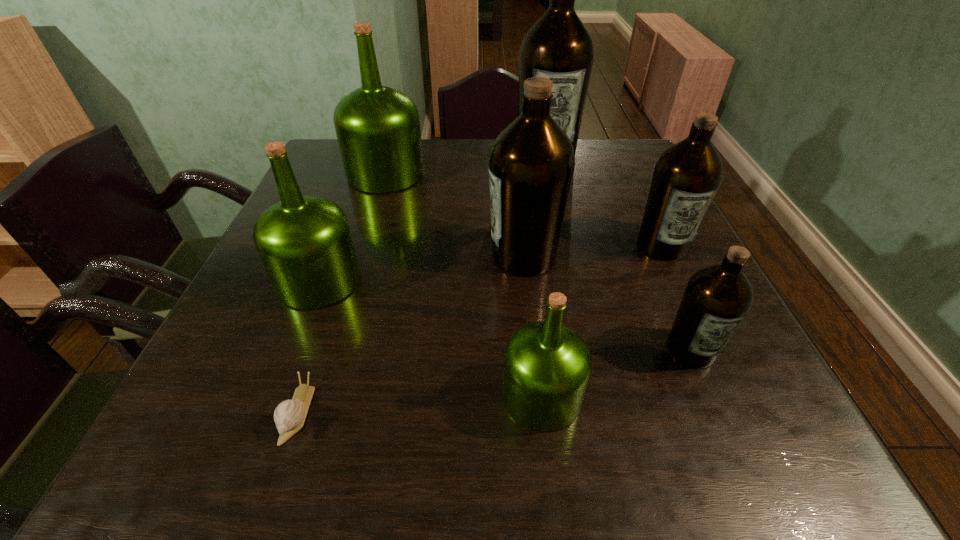
Where is `blank space located 0.200m on the label of the tallest object`? blank space located 0.200m on the label of the tallest object is located at coordinates (559, 212).

Locate an element on the screen. vacant space situated on the right of the biggest green olive oil is located at coordinates (510, 174).

This screenshot has height=540, width=960. What are the coordinates of `vacant region located on the label of the third smallest brown olive oil` in the screenshot? It's located at (387, 256).

Find the location of `vacant region located 0.310m on the label of the third smallest brown olive oil`. vacant region located 0.310m on the label of the third smallest brown olive oil is located at coordinates (347, 256).

The image size is (960, 540). In order to click on free space located on the label of the third smallest brown olive oil in this screenshot , I will do `click(419, 256)`.

The image size is (960, 540). What are the coordinates of `vacant space situated on the label of the second smallest brown olive oil` in the screenshot? It's located at (696, 316).

Locate an element on the screen. This screenshot has height=540, width=960. vacant space positioned 0.180m on the front of the second biggest green olive oil is located at coordinates (276, 392).

At what (x,y) coordinates should I click in order to perform the action: click on vacant area situated on the label of the nearest brown olive oil. Please return your answer as a coordinate pair (x, y). Looking at the image, I should click on (748, 479).

Identify the location of free space located on the back of the rightmost green olive oil. The image size is (960, 540). (531, 301).

What are the coordinates of `olive oil that is at the near edge` in the screenshot? It's located at (547, 365).